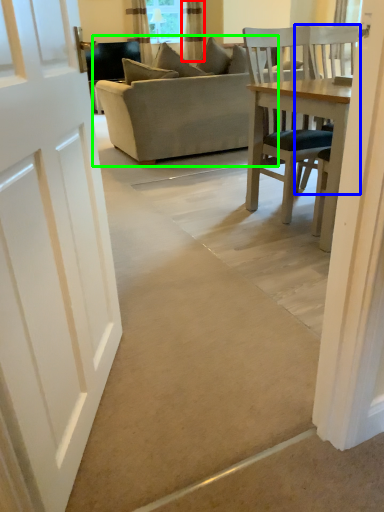
Question: Based on their relative distances, which object is farther from curtain (highlighted by a red box)? Choose from chair (highlighted by a blue box) and studio couch (highlighted by a green box).

Choices:
 (A) chair
 (B) studio couch

Answer: (A)